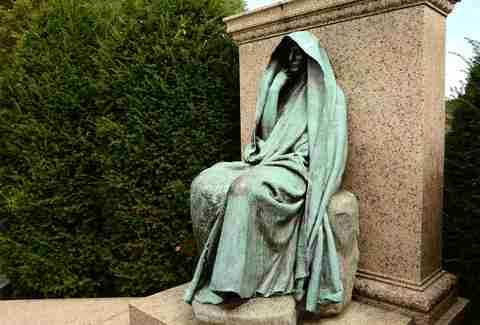
I want to click on hood, so click(310, 41).